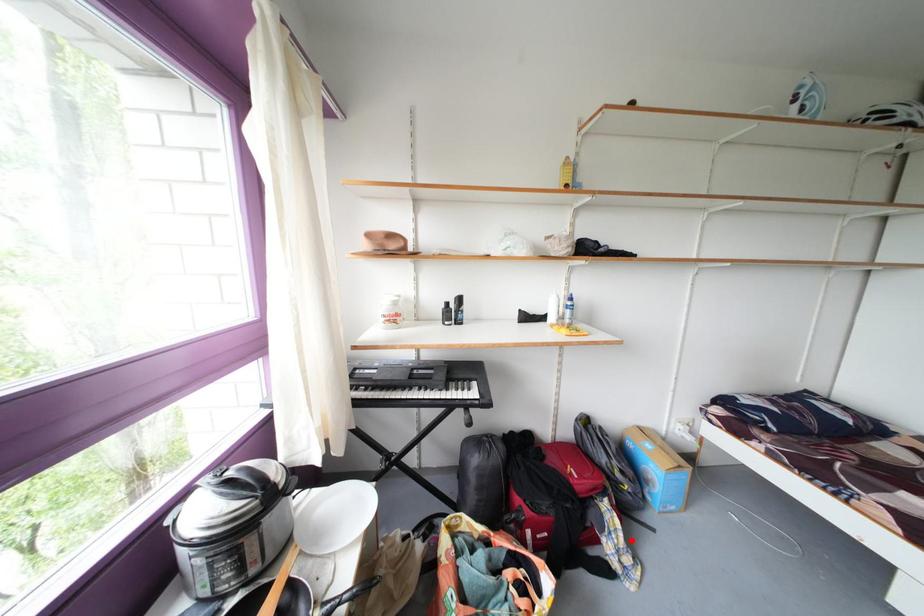
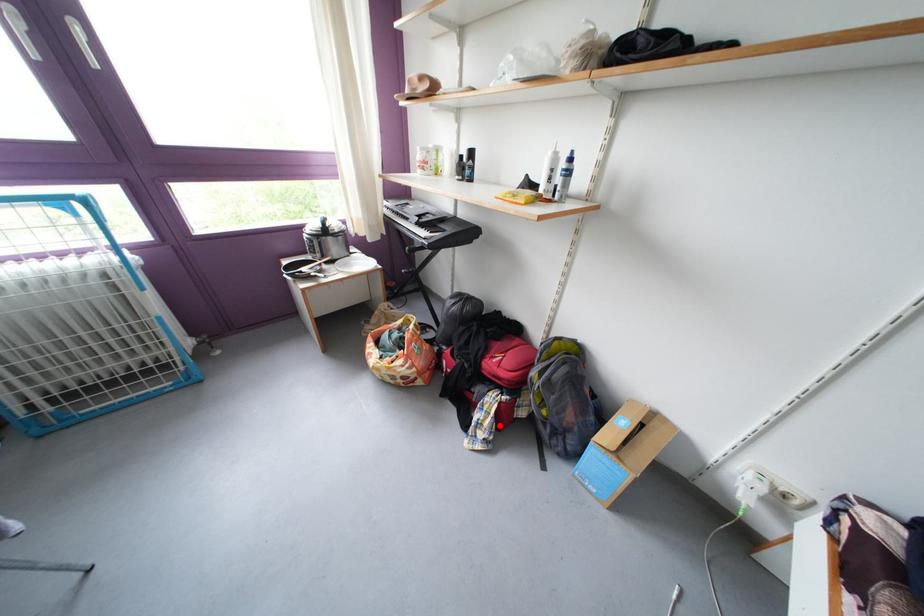
I am providing you with two images of the same scene from different viewpoints. A red point is marked on the first image and another point is marked on the second image. Are the points marked in image1 and image2 representing the same 3D position?

Yes